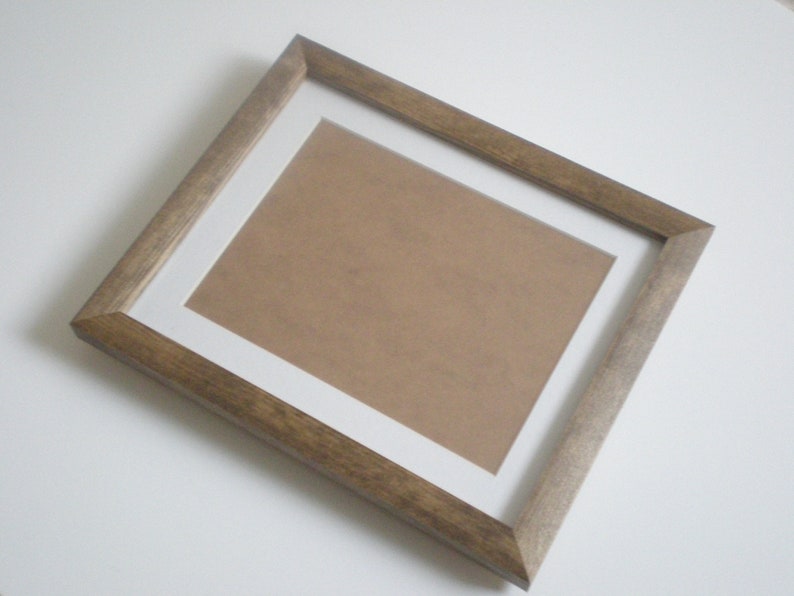
Locate an element on the screen. This screenshot has width=794, height=596. white mat is located at coordinates pyautogui.click(x=553, y=397).